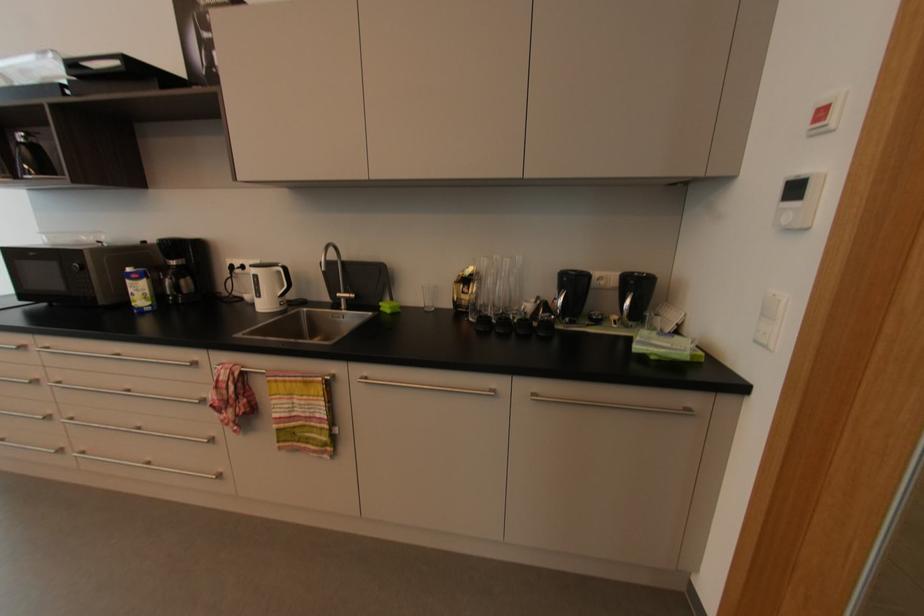
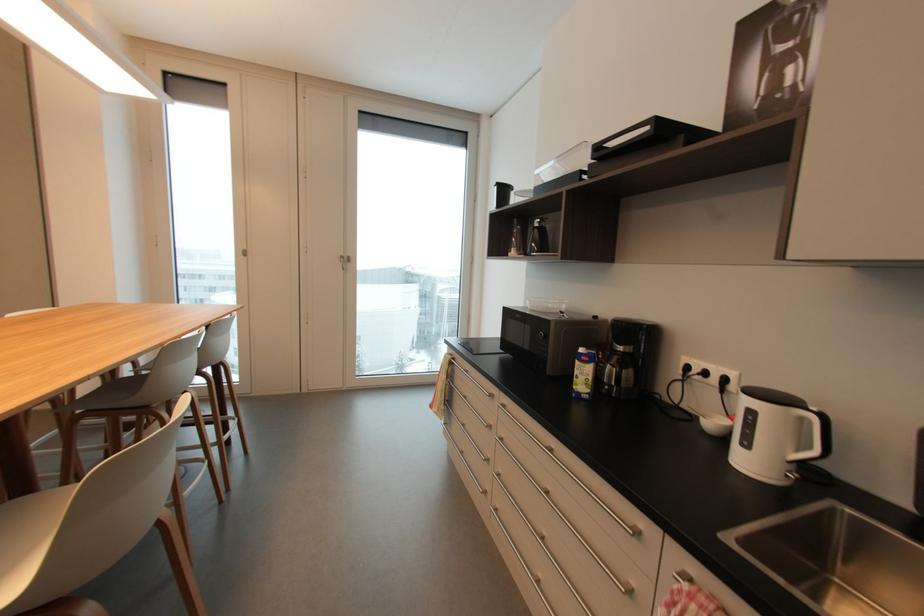
Question: The images are taken continuously from a first-person perspective. In which direction is your viewpoint rotating?

Choices:
 (A) Left
 (B) Right
 (C) Up
 (D) Down

Answer: (A)